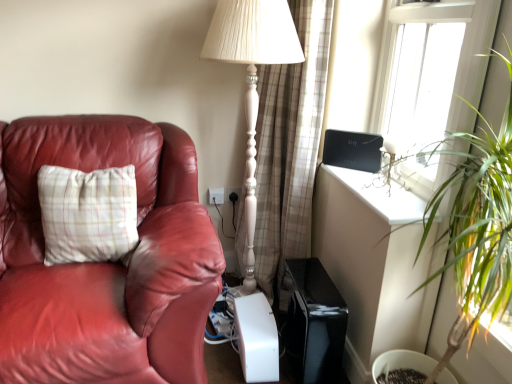
Question: In which direction should I rotate to look at white plastic electric outlet at lower center, the 2th electric outlet viewed from the right?

Choices:
 (A) left
 (B) right

Answer: (A)

Question: Is plaid fabric curtain at center at the left side of white plastic electric outlet at lower center, the first electric outlet in the left-to-right sequence?

Choices:
 (A) yes
 (B) no

Answer: (B)

Question: Is plaid fabric curtain at center not inside white plastic electric outlet at lower center, the first electric outlet in the left-to-right sequence?

Choices:
 (A) yes
 (B) no

Answer: (A)

Question: Is the depth of plaid fabric curtain at center greater than that of white plastic electric outlet at lower center, the first electric outlet in the left-to-right sequence?

Choices:
 (A) no
 (B) yes

Answer: (A)

Question: Is white plastic electric outlet at lower center, the 2th electric outlet viewed from the right, completely or partially inside plaid fabric curtain at center?

Choices:
 (A) yes
 (B) no

Answer: (B)

Question: Is plaid fabric curtain at center to the right of white plastic electric outlet at lower center, the 2th electric outlet viewed from the right, from the viewer's perspective?

Choices:
 (A) yes
 (B) no

Answer: (A)

Question: Can you confirm if plaid fabric curtain at center is taller than white plastic electric outlet at lower center, the 2th electric outlet viewed from the right?

Choices:
 (A) yes
 (B) no

Answer: (A)

Question: From the image's perspective, is white plastic electric outlet at lower center, the first electric outlet in the left-to-right sequence, located above transparent glass window at upper right?

Choices:
 (A) no
 (B) yes

Answer: (A)

Question: Is transparent glass window at upper right completely or partially inside white plastic electric outlet at lower center, the 2th electric outlet viewed from the right?

Choices:
 (A) yes
 (B) no

Answer: (B)

Question: Does white plastic electric outlet at lower center, the first electric outlet in the left-to-right sequence, touch transparent glass window at upper right?

Choices:
 (A) yes
 (B) no

Answer: (B)

Question: Is white plastic electric outlet at lower center, the first electric outlet in the left-to-right sequence, oriented away from transparent glass window at upper right?

Choices:
 (A) yes
 (B) no

Answer: (B)

Question: Considering the relative sizes of white plastic electric outlet at lower center, the first electric outlet in the left-to-right sequence, and transparent glass window at upper right in the image provided, is white plastic electric outlet at lower center, the first electric outlet in the left-to-right sequence, shorter than transparent glass window at upper right?

Choices:
 (A) yes
 (B) no

Answer: (A)

Question: Is white plastic electric outlet at lower center, the 2th electric outlet viewed from the right, smaller than transparent glass window at upper right?

Choices:
 (A) yes
 (B) no

Answer: (A)

Question: Are plaid fabric curtain at center and white plastic electric outlet at lower center, arranged as the 2th electric outlet when viewed from the left, beside each other?

Choices:
 (A) no
 (B) yes

Answer: (A)